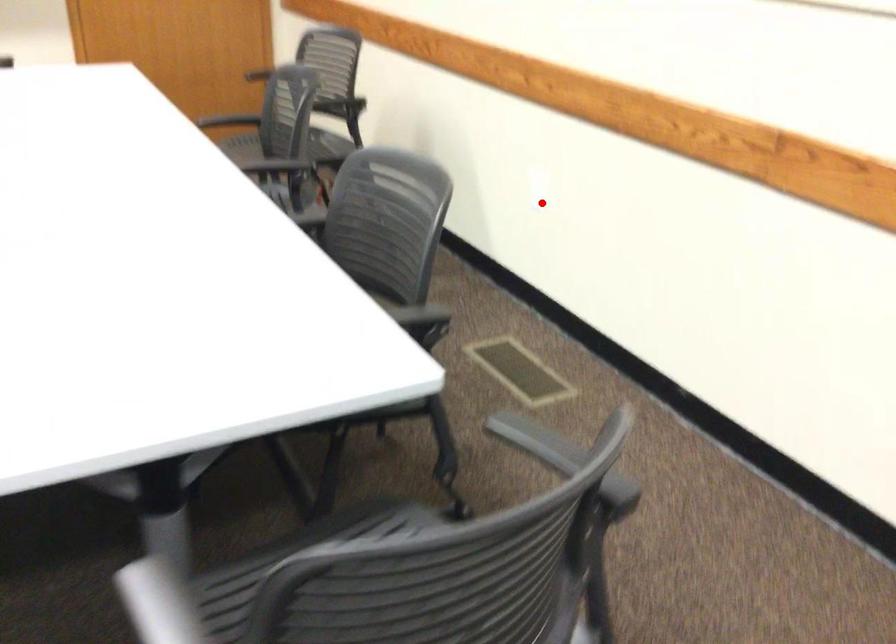
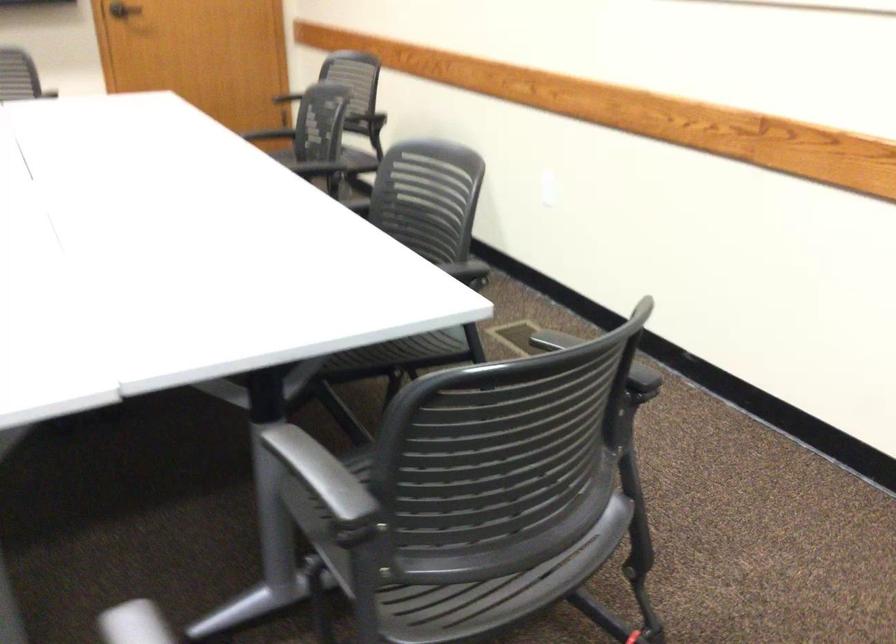
Question: I am providing you with two images of the same scene from different viewpoints. A red point is shown in image1. For the corresponding object point in image2, is it positioned nearer or farther from the camera?

Choices:
 (A) Nearer
 (B) Farther

Answer: (B)